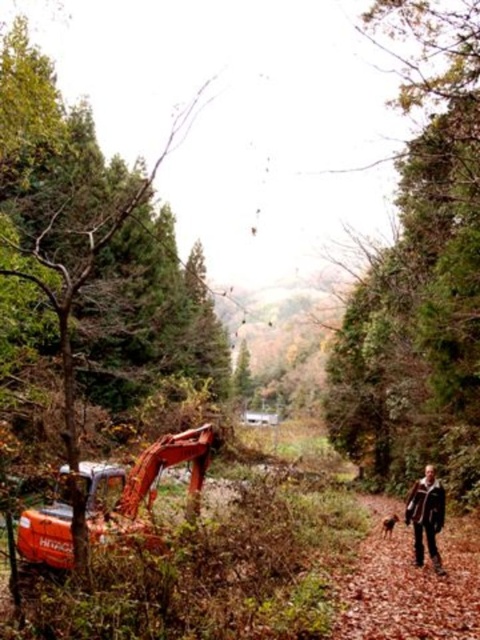
Locate an element on the screen. The width and height of the screenshot is (480, 640). green leafy tree at right is located at coordinates (420, 273).

This screenshot has width=480, height=640. Identify the location of green leafy tree at right. (420, 273).

Consider the image. Who is higher up, orange metallic excavator at left or brown furry dog at lower right?

orange metallic excavator at left is higher up.

Is orange metallic excavator at left thinner than brown furry dog at lower right?

In fact, orange metallic excavator at left might be wider than brown furry dog at lower right.

At what (x,y) coordinates should I click in order to perform the action: click on orange metallic excavator at left. Please return your answer as a coordinate pair (x, y). This screenshot has width=480, height=640. Looking at the image, I should click on (67, 216).

From the picture: Is orange metallic excavator at lower left to the left of brown leather jacket at lower right from the viewer's perspective?

Yes, orange metallic excavator at lower left is to the left of brown leather jacket at lower right.

What do you see at coordinates (142, 481) in the screenshot? This screenshot has width=480, height=640. I see `orange metallic excavator at lower left` at bounding box center [142, 481].

Does point (37, 556) come behind point (429, 499)?

Yes.

Locate an element on the screen. The height and width of the screenshot is (640, 480). orange metallic excavator at lower left is located at coordinates (142, 481).